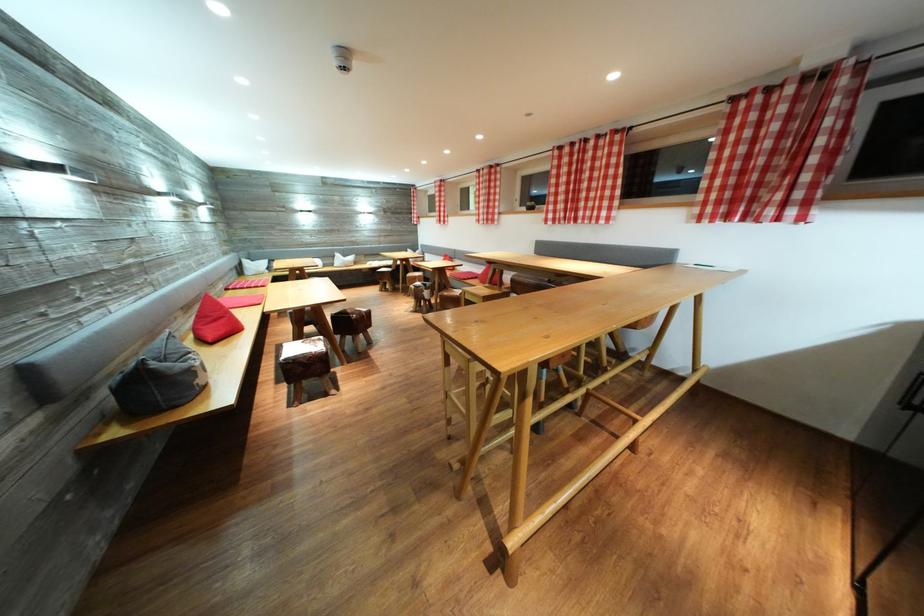
Where would you sit the gray beanbag cushion? Please return your answer as a coordinate pair (x, y).

(157, 381)